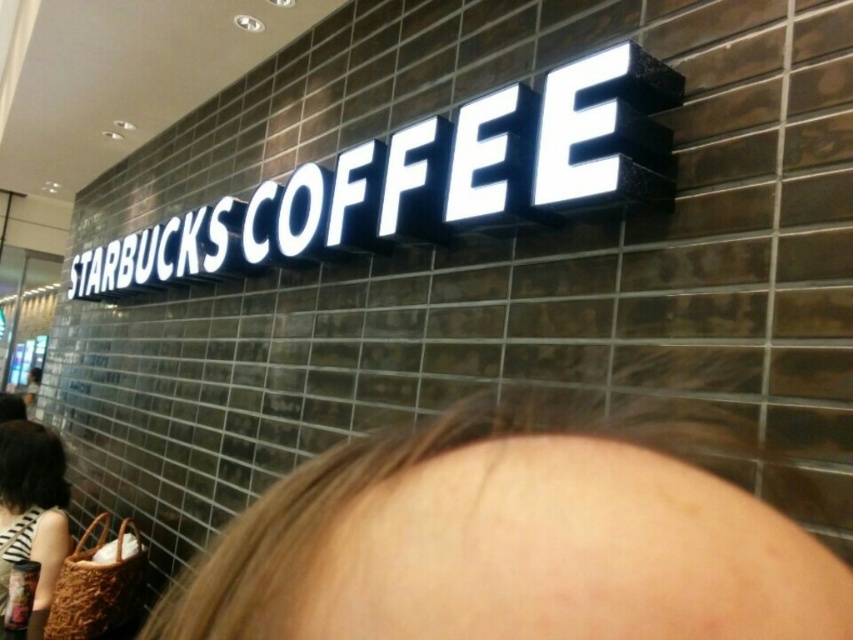
Question: Which point is farther from the camera taking this photo?

Choices:
 (A) (1, 560)
 (B) (80, 284)

Answer: (B)

Question: Does white glossy sign at center have a larger size compared to striped fabric bag at lower left?

Choices:
 (A) no
 (B) yes

Answer: (B)

Question: Which of the following is the closest to the observer?

Choices:
 (A) (33, 513)
 (B) (462, 220)

Answer: (B)

Question: In this image, where is white glossy sign at center located relative to striped fabric bag at lower left?

Choices:
 (A) right
 (B) left

Answer: (A)

Question: Can you confirm if white glossy sign at center is wider than striped fabric bag at lower left?

Choices:
 (A) yes
 (B) no

Answer: (A)